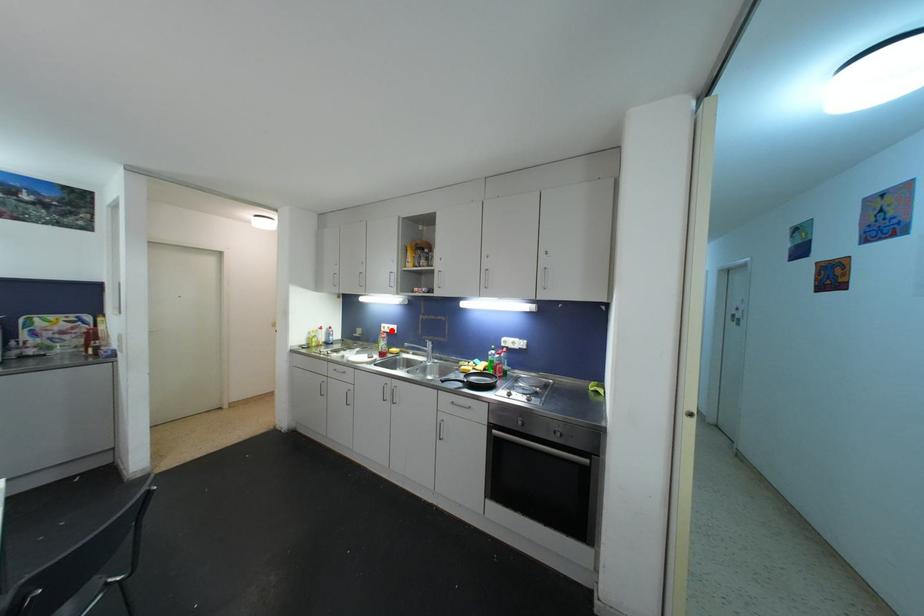
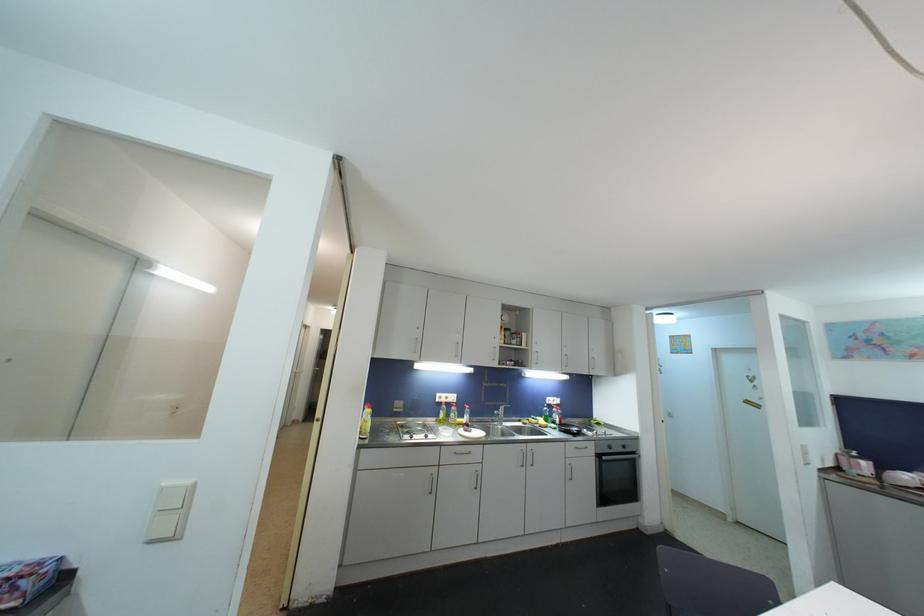
The point at the highlighted location is marked in the first image. Where is the corresponding point in the second image?

(450, 400)